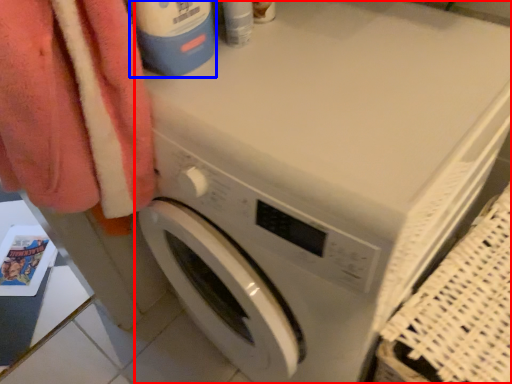
Question: Which of the following is the farthest to the observer, washing machine (highlighted by a red box) or cleaning product (highlighted by a blue box)?

Choices:
 (A) washing machine
 (B) cleaning product

Answer: (B)